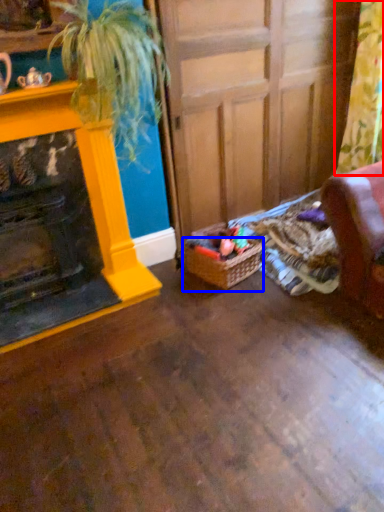
Question: Which of the following is the farthest to the observer, curtain (highlighted by a red box) or basket (highlighted by a blue box)?

Choices:
 (A) curtain
 (B) basket

Answer: (B)